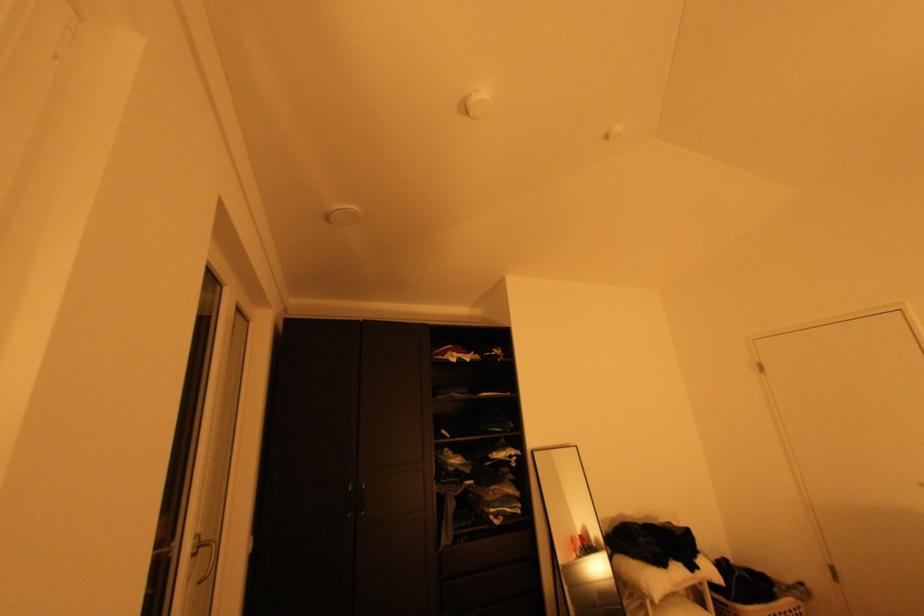
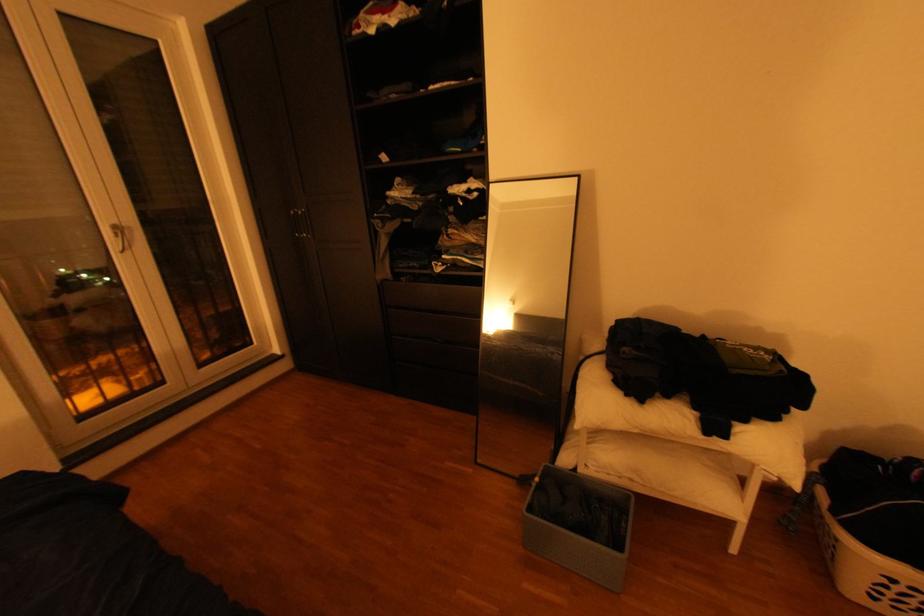
In the second image, find the point that corresponds to pixel 708 568 in the first image.

(735, 436)